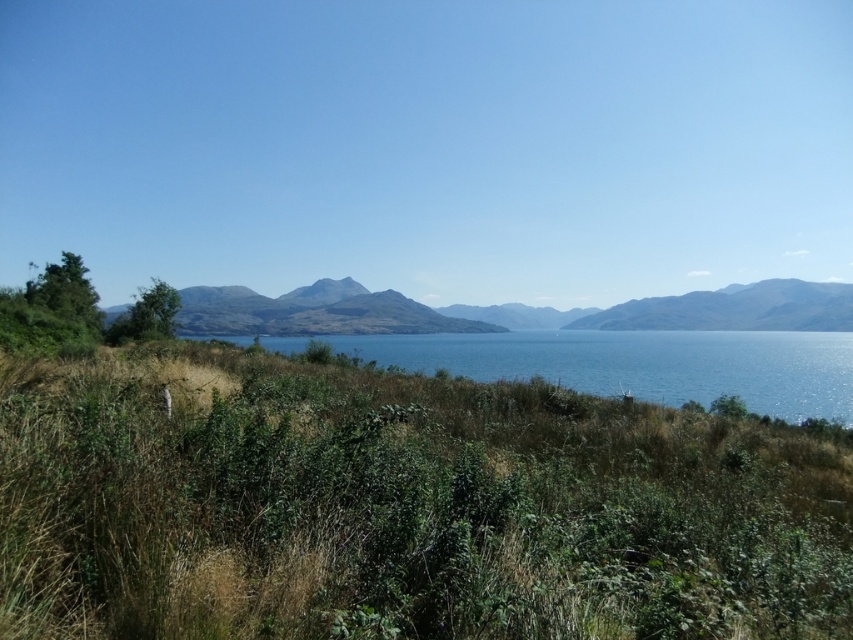
Does green grassy at lower center appear on the left side of blue water at center?

Indeed, green grassy at lower center is positioned on the left side of blue water at center.

This screenshot has height=640, width=853. In order to click on green grassy at lower center in this screenshot , I will do pyautogui.click(x=399, y=506).

Where is `green grassy at lower center`? This screenshot has width=853, height=640. green grassy at lower center is located at coordinates (399, 506).

Between blue water at center and smooth gray mountain at center, which one has less height?

Standing shorter between the two is blue water at center.

Does point (625, 358) come behind point (660, 301)?

No, (625, 358) is in front of (660, 301).

At what (x,y) coordinates should I click in order to perform the action: click on blue water at center. Please return your answer as a coordinate pair (x, y). The width and height of the screenshot is (853, 640). Looking at the image, I should click on (642, 364).

Is point (167, 568) closer to viewer compared to point (752, 316)?

Yes.

Does green grassy at lower center have a greater width compared to smooth gray mountain at center?

Incorrect, green grassy at lower center's width does not surpass smooth gray mountain at center's.

Is point (720, 413) more distant than point (735, 298)?

No, it is not.

Find the location of `green grassy at lower center`. green grassy at lower center is located at coordinates (399, 506).